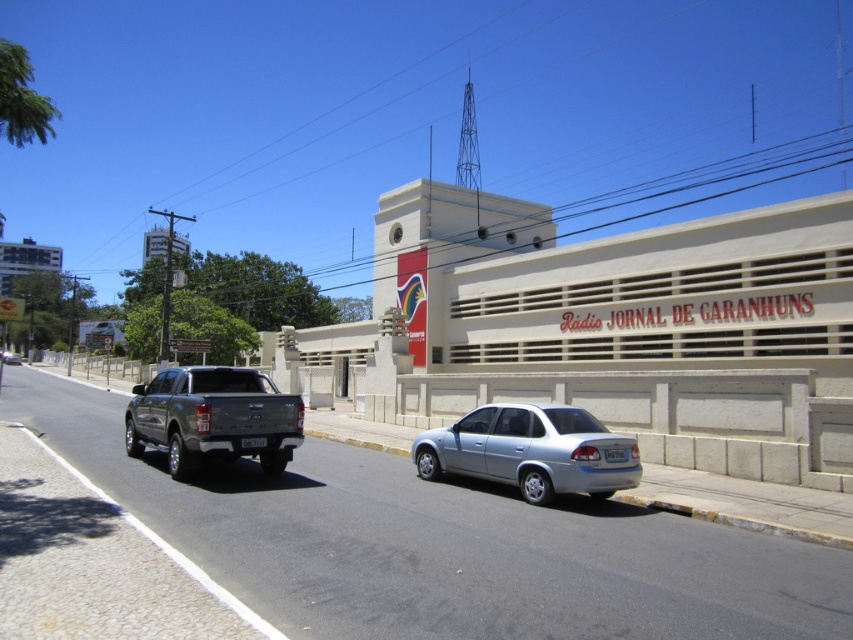
You are standing at the entrance of the building and want to park your car. The parking spot you want is at coordinates point 0.705, 0.621. Is the satin silver sedan at lower center blocking your desired parking spot?

The satin silver sedan at lower center is located at point (x=529, y=451), so it is blocking your desired parking spot.

You are standing on the sidewalk in front of the building with the radio station sign. There are two points marked on the ground. Which point is closer to you, point (242,444) or point (15,362)?

Point (242,444) is closer to the viewer than point (15,362).

You are a delivery driver who needs to park your vehicle between the black plastic license plate at rear and the silver metallic sedan at center. The minimum distance required for safe parking between vehicles is 250 feet. Can you safely park your vehicle in this spot?

The distance between the black plastic license plate at rear and the silver metallic sedan at center is 248.84 feet, which is less than the required 250 feet for safe parking. Therefore, you cannot safely park your vehicle in this spot.